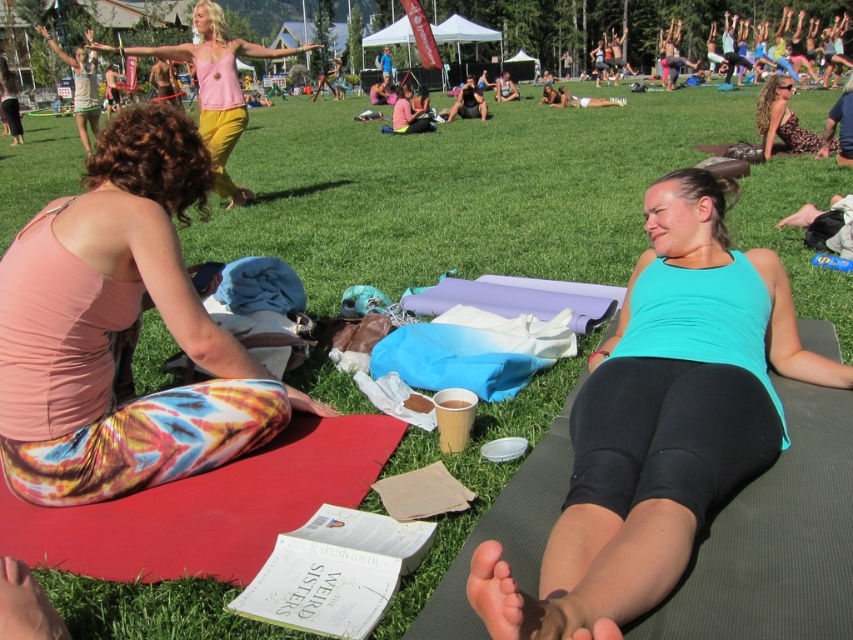
You are a photographer standing at the edge of the grassy field where the yoga session is happening. You want to take a photo that includes both the pink matte tank top at upper center and the printed floral dress at upper right. Considering their distance apart, do you think you can fit both into your camera frame without moving closer or further away?

The pink matte tank top at upper center is 9.65 meters away from the printed floral dress at upper right. Since the distance between them is quite large, it might be challenging to capture both in a single frame without adjusting your position. However, using a wide angle lens could potentially include both subjects in the shot.